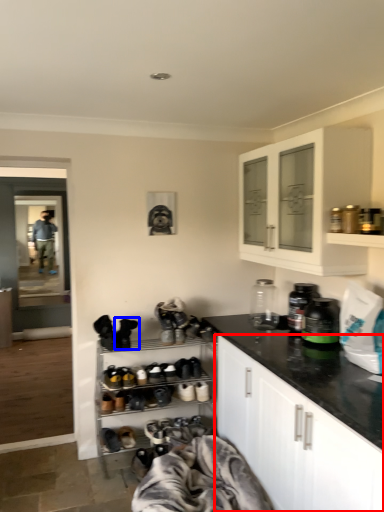
Question: Which object is closer to the camera taking this photo, cabinetry (highlighted by a red box) or footwear (highlighted by a blue box)?

Choices:
 (A) cabinetry
 (B) footwear

Answer: (A)